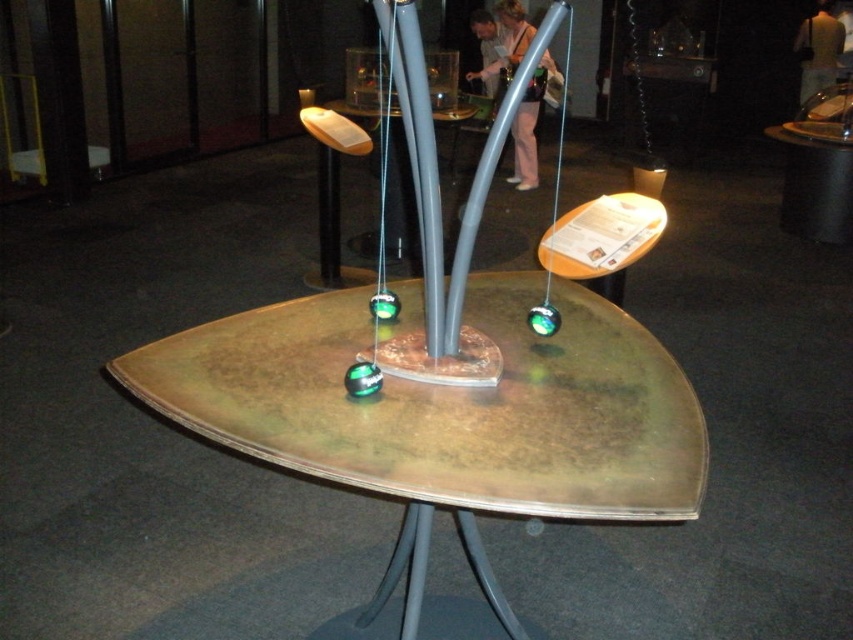
Can you confirm if bronze metallic table at center is positioned above metallic gray table at center?

No, bronze metallic table at center is not above metallic gray table at center.

Who is shorter, bronze metallic table at center or metallic gray table at center?

bronze metallic table at center is shorter.

Is point (177, 394) more distant than point (370, 275)?

No, (177, 394) is in front of (370, 275).

Where is `bronze metallic table at center`? This screenshot has height=640, width=853. bronze metallic table at center is located at coordinates (447, 417).